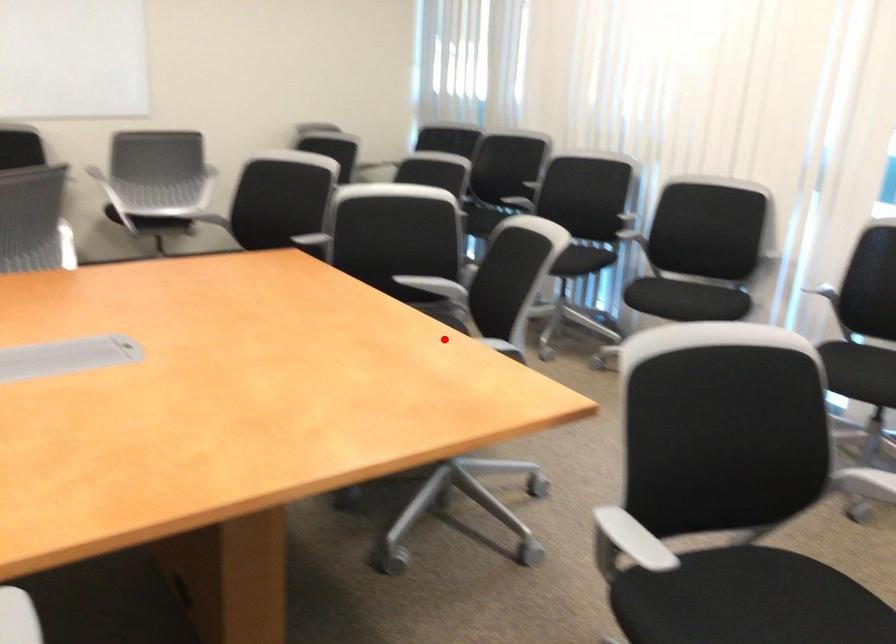
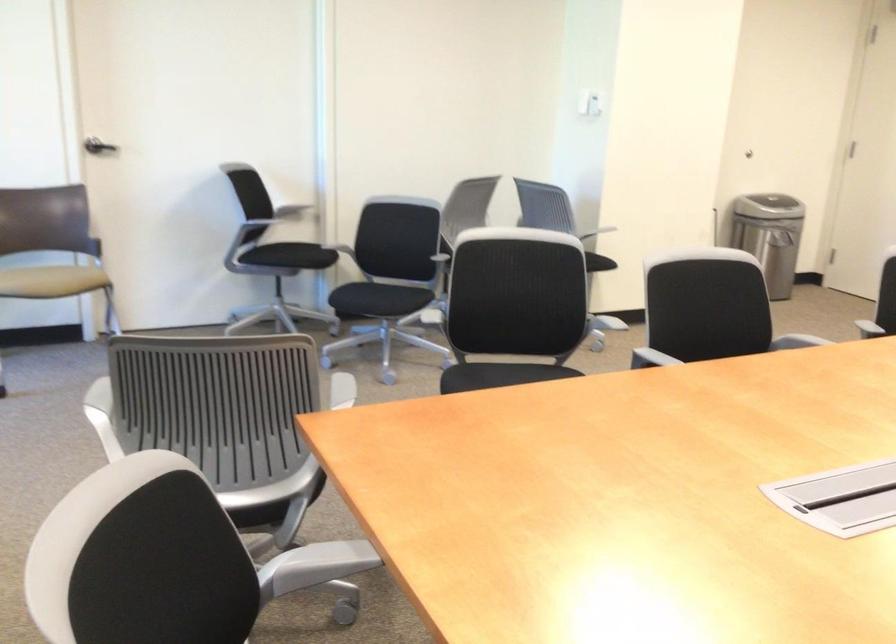
Find the pixel in the second image that matches the highlighted location in the first image.

(320, 562)